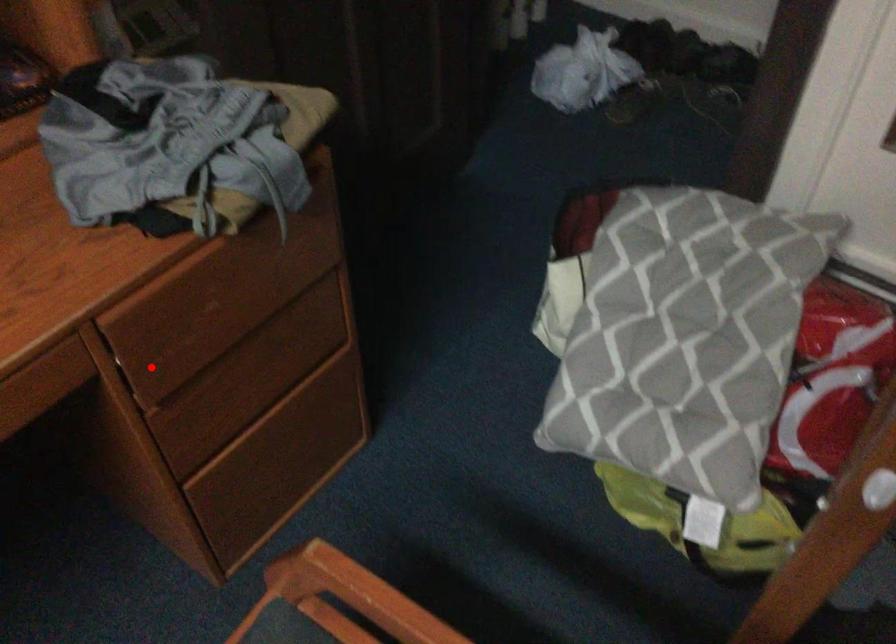
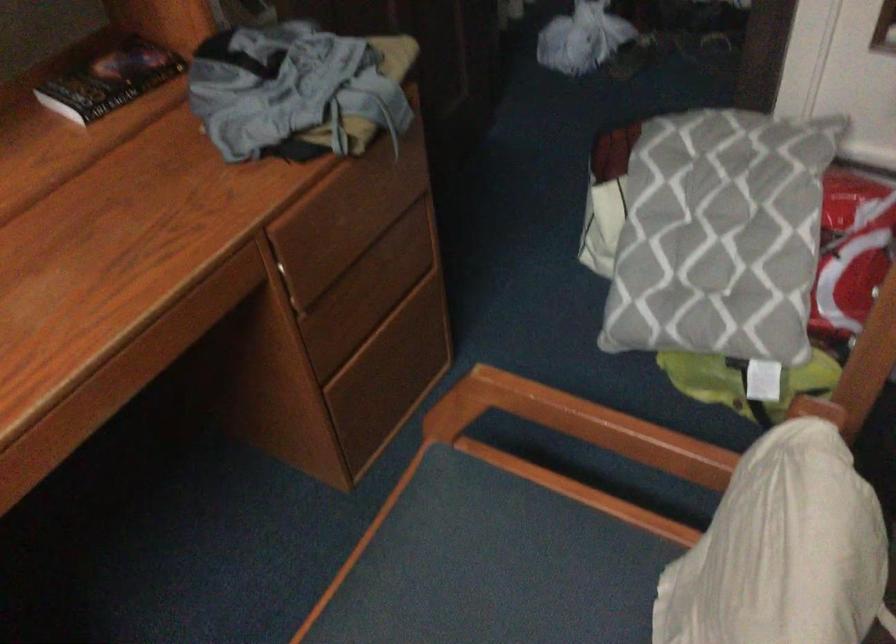
Question: I am providing you with two images of the same scene from different viewpoints. Given a red point in image1, look at the same physical point in image2. Is it:

Choices:
 (A) Closer to the viewpoint
 (B) Farther from the viewpoint

Answer: (B)